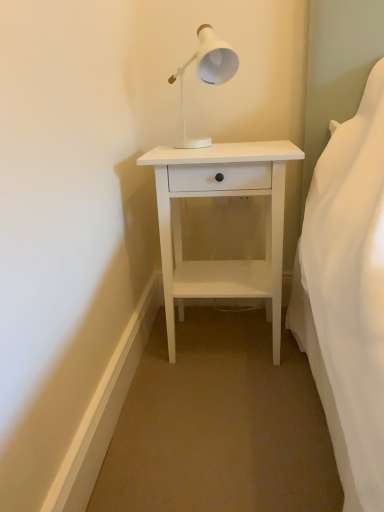
Question: Does white matte lamp at upper center turn towards white matte nightstand at center?

Choices:
 (A) yes
 (B) no

Answer: (B)

Question: Is white matte lamp at upper center wider than white matte nightstand at center?

Choices:
 (A) no
 (B) yes

Answer: (A)

Question: From a real-world perspective, is white matte lamp at upper center below white matte nightstand at center?

Choices:
 (A) yes
 (B) no

Answer: (B)

Question: Are white matte lamp at upper center and white matte nightstand at center beside each other?

Choices:
 (A) yes
 (B) no

Answer: (B)

Question: Can you confirm if white matte lamp at upper center is bigger than white matte nightstand at center?

Choices:
 (A) yes
 (B) no

Answer: (B)

Question: Can you confirm if white matte lamp at upper center is shorter than white matte nightstand at center?

Choices:
 (A) yes
 (B) no

Answer: (A)

Question: Is white matte nightstand at center far from white matte lamp at upper center?

Choices:
 (A) no
 (B) yes

Answer: (A)

Question: Is white matte nightstand at center smaller than white matte lamp at upper center?

Choices:
 (A) no
 (B) yes

Answer: (A)

Question: Is white matte nightstand at center bigger than white matte lamp at upper center?

Choices:
 (A) no
 (B) yes

Answer: (B)

Question: Can you confirm if white matte nightstand at center is taller than white matte lamp at upper center?

Choices:
 (A) no
 (B) yes

Answer: (B)

Question: Is white matte nightstand at center to the right of white matte lamp at upper center from the viewer's perspective?

Choices:
 (A) no
 (B) yes

Answer: (B)

Question: From the image's perspective, is white matte nightstand at center under white matte lamp at upper center?

Choices:
 (A) yes
 (B) no

Answer: (A)

Question: Based on their sizes in the image, would you say white matte nightstand at center is bigger or smaller than white matte lamp at upper center?

Choices:
 (A) small
 (B) big

Answer: (B)